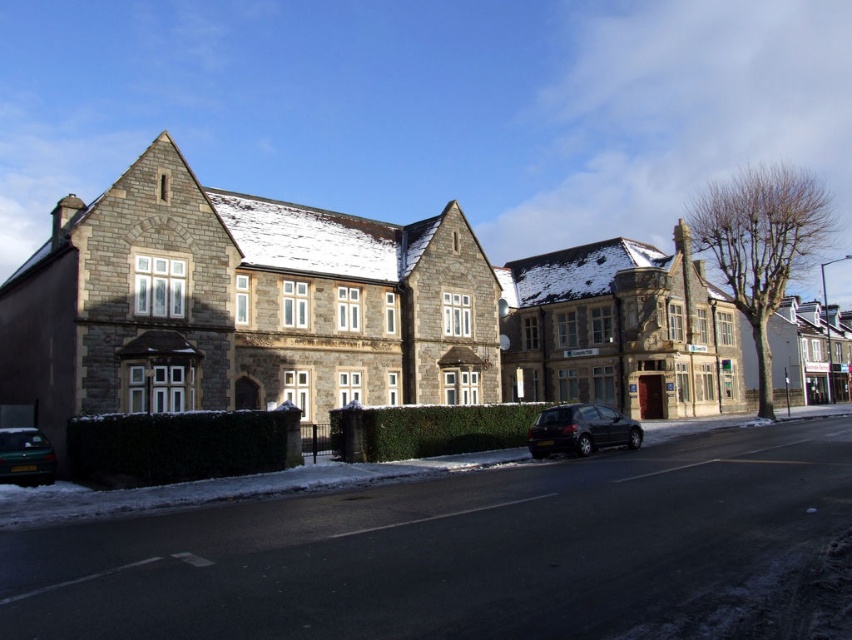
Does shiny black hatchback at center appear over green matte car at lower left?

Actually, shiny black hatchback at center is below green matte car at lower left.

Can you confirm if shiny black hatchback at center is shorter than green matte car at lower left?

No, shiny black hatchback at center is not shorter than green matte car at lower left.

Between point (597, 417) and point (26, 442), which one is positioned behind?

The point (597, 417) is behind.

Locate an element on the screen. shiny black hatchback at center is located at coordinates (580, 429).